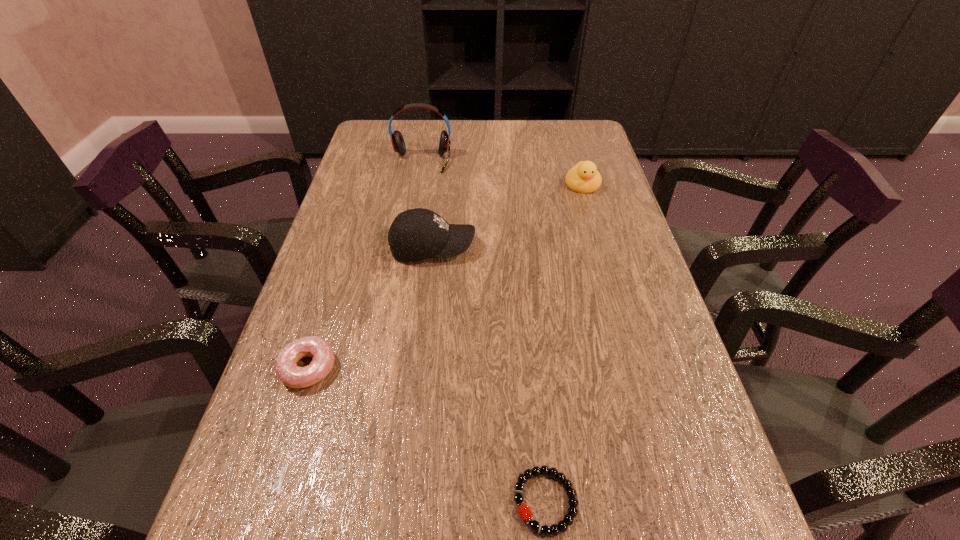
This screenshot has width=960, height=540. I want to click on the farthest object, so click(x=397, y=140).

You are a GUI agent. You are given a task and a screenshot of the screen. Output one action in this format:
    pyautogui.click(x=<x>, y=<y>)
    Task: Click on the headset
    This screenshot has width=960, height=540.
    Given the screenshot: What is the action you would take?
    (397, 140)

The height and width of the screenshot is (540, 960). I want to click on the second tallest object, so click(417, 234).

Image resolution: width=960 pixels, height=540 pixels. Find the location of `the third farthest object`. the third farthest object is located at coordinates (417, 234).

The width and height of the screenshot is (960, 540). Find the location of `the third shortest object`. the third shortest object is located at coordinates (584, 178).

Identify the location of the second farthest object. (584, 178).

The image size is (960, 540). What are the coordinates of `doughnut` in the screenshot? It's located at (293, 376).

Image resolution: width=960 pixels, height=540 pixels. I want to click on the second nearest object, so (x=293, y=376).

What are the coordinates of `the fourth object from left to right` in the screenshot? It's located at (568, 519).

The image size is (960, 540). Identify the location of the nearest object. (568, 519).